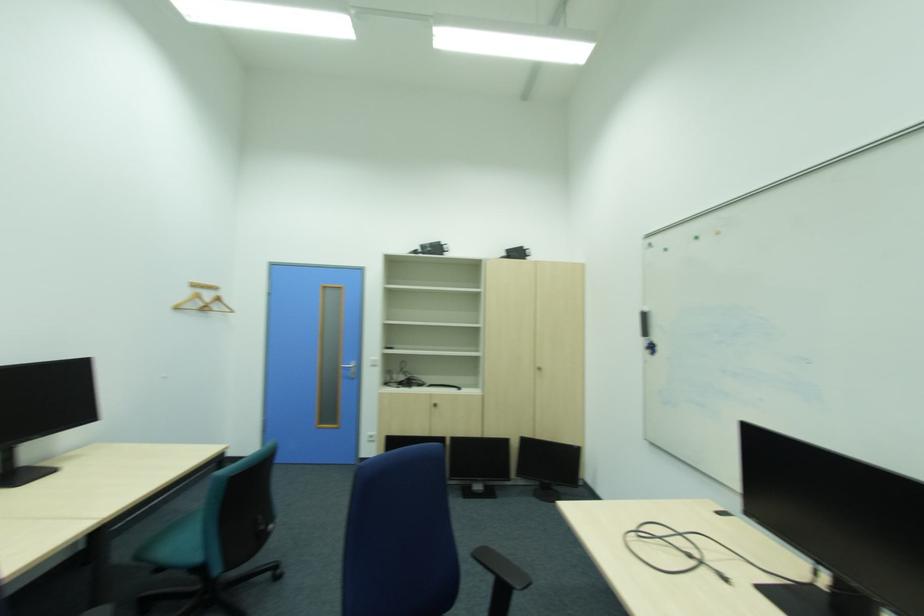
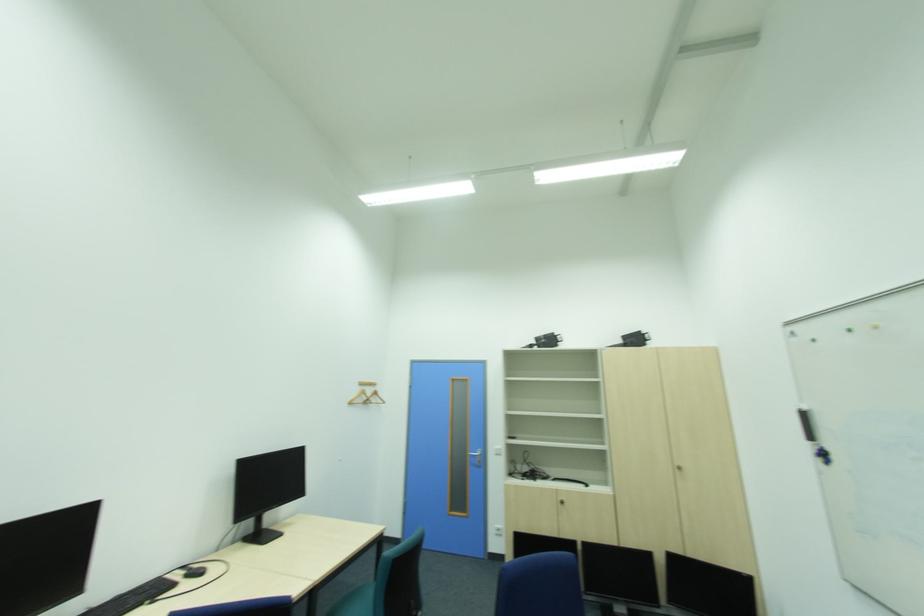
Question: The camera is either moving clockwise (left) or counter-clockwise (right) around the object. The first image is from the beginning of the video and the second image is from the end. Is the camera moving left or right when shooting the video?

Choices:
 (A) Left
 (B) Right

Answer: (B)